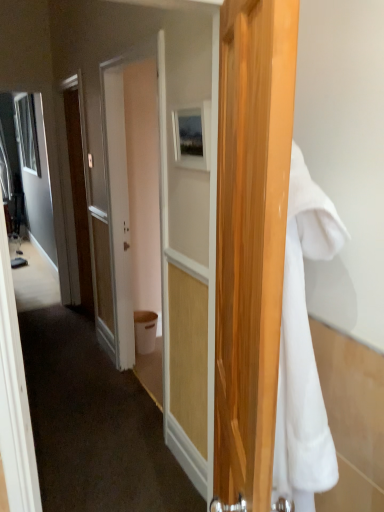
Question: Considering the relative positions of white fluffy towel at right and matte wooden picture frame at center in the image provided, is white fluffy towel at right to the left of matte wooden picture frame at center from the viewer's perspective?

Choices:
 (A) yes
 (B) no

Answer: (B)

Question: From a real-world perspective, is white fluffy towel at right physically below matte wooden picture frame at center?

Choices:
 (A) no
 (B) yes

Answer: (B)

Question: Is white fluffy towel at right smaller than matte wooden picture frame at center?

Choices:
 (A) no
 (B) yes

Answer: (A)

Question: Can you confirm if white fluffy towel at right is wider than matte wooden picture frame at center?

Choices:
 (A) no
 (B) yes

Answer: (B)

Question: Does white fluffy towel at right turn towards matte wooden picture frame at center?

Choices:
 (A) yes
 (B) no

Answer: (B)

Question: From a real-world perspective, is white plastic trash bin at center above or below matte white door at center?

Choices:
 (A) above
 (B) below

Answer: (B)

Question: Is point (140, 315) positioned closer to the camera than point (81, 157)?

Choices:
 (A) closer
 (B) farther

Answer: (A)

Question: Would you say white plastic trash bin at center is inside or outside matte white door at center?

Choices:
 (A) inside
 (B) outside

Answer: (B)

Question: In the image, is white plastic trash bin at center on the left side or the right side of matte white door at center?

Choices:
 (A) left
 (B) right

Answer: (B)

Question: From the image's perspective, relative to white fluffy towel at right, is white plastic trash bin at center above or below?

Choices:
 (A) above
 (B) below

Answer: (B)

Question: In terms of width, does white plastic trash bin at center look wider or thinner when compared to white fluffy towel at right?

Choices:
 (A) thin
 (B) wide

Answer: (A)

Question: From a real-world perspective, relative to white fluffy towel at right, is white plastic trash bin at center vertically above or below?

Choices:
 (A) below
 (B) above

Answer: (A)

Question: In terms of height, does white plastic trash bin at center look taller or shorter compared to white fluffy towel at right?

Choices:
 (A) tall
 (B) short

Answer: (B)

Question: Is white fluffy towel at right wider or thinner than matte white door at center?

Choices:
 (A) thin
 (B) wide

Answer: (B)

Question: Relative to matte white door at center, is white fluffy towel at right in front or behind?

Choices:
 (A) behind
 (B) front

Answer: (B)